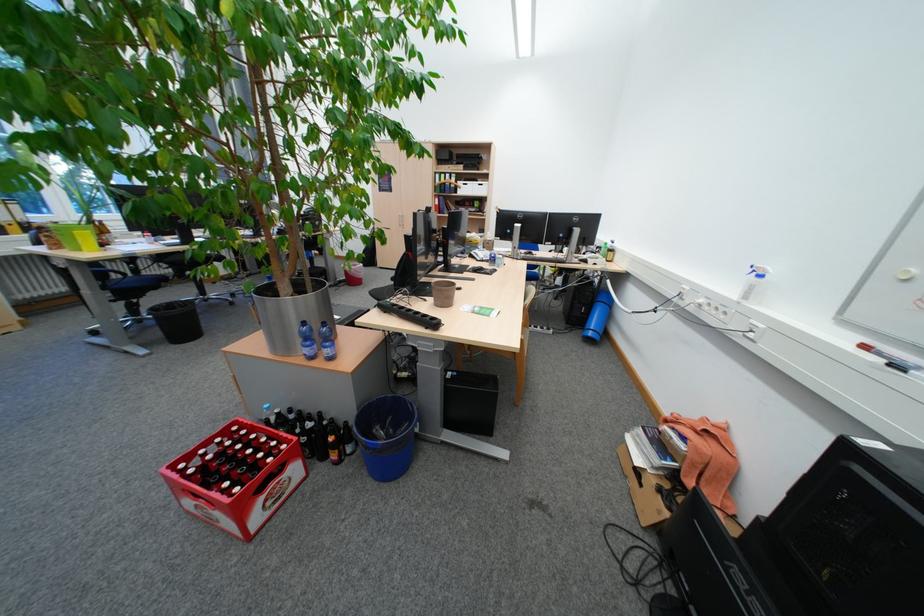
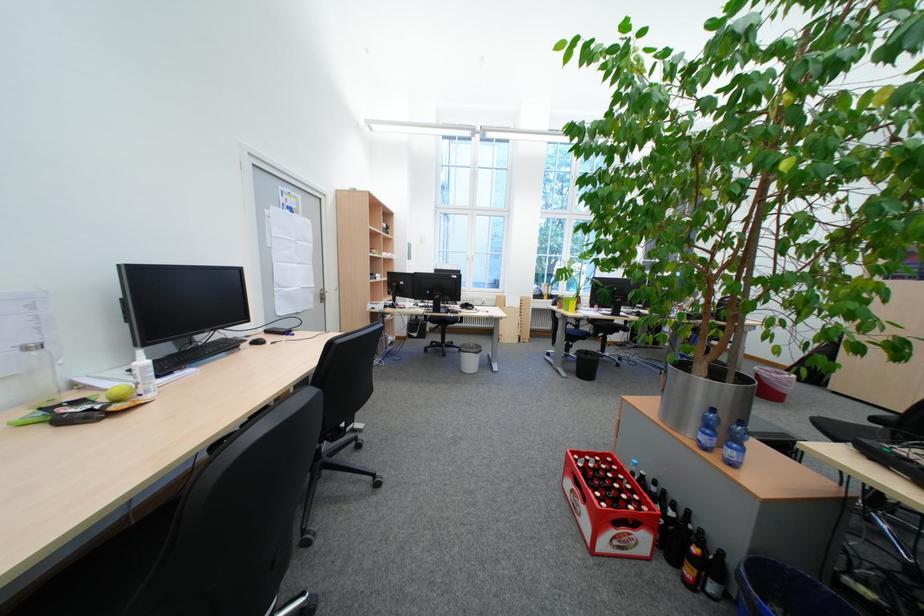
Find the pixel in the second image that matches (343,440) in the first image.

(707, 551)